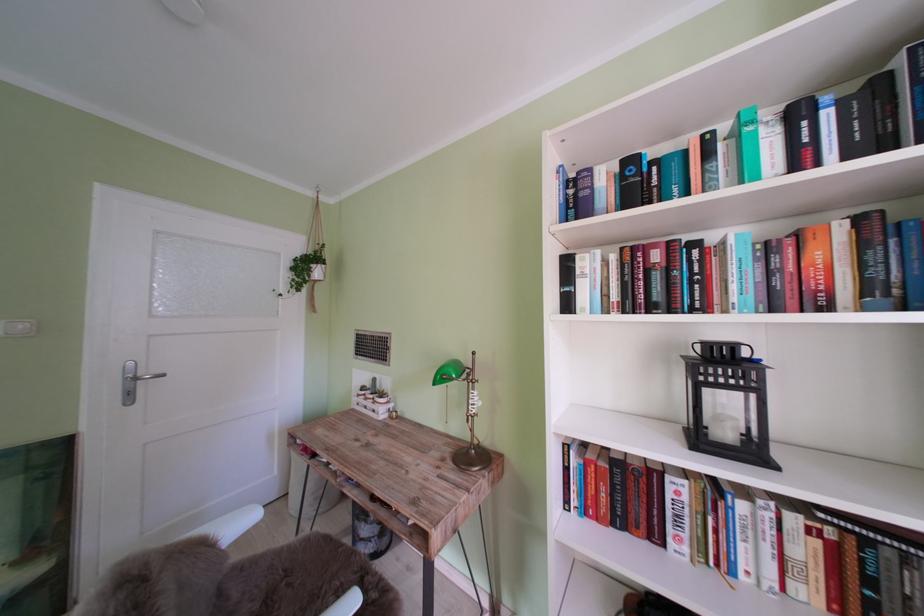
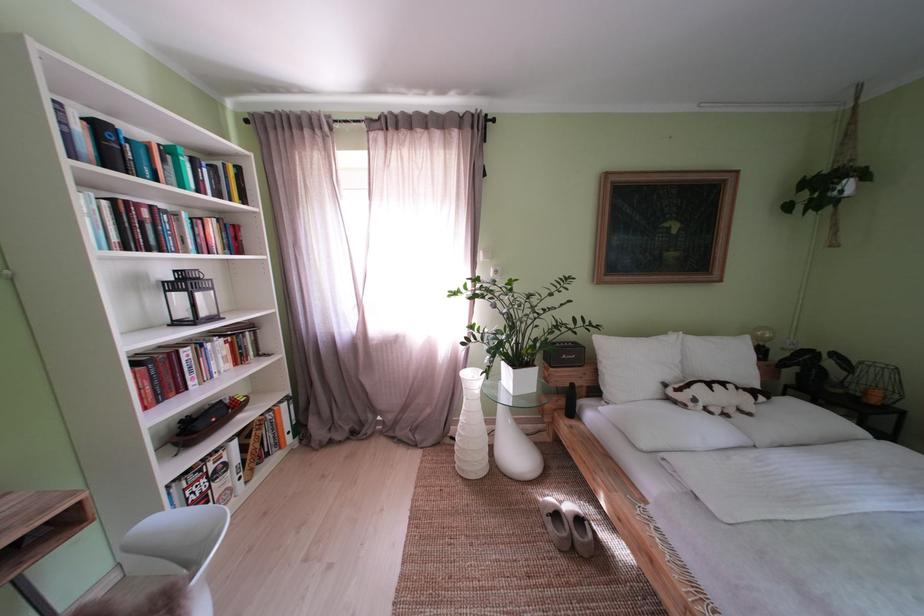
Locate, in the second image, the point that corresponds to point (733, 370) in the first image.

(198, 286)